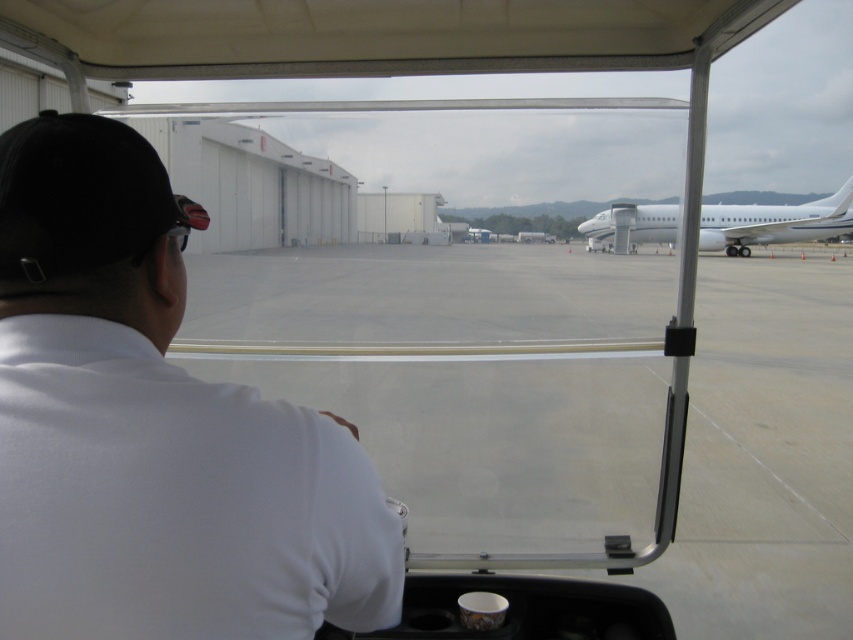
You are an airport security inspector checking the vehicle for any irregularities. You notice the white matte shirt at left and the white glossy airplane at right. Which object is wider in the image?

The white glossy airplane at right is wider than the white matte shirt at left.

You are a passenger in the vehicle and want to know which object is closer to you based on their sizes. Which one is closer between the white matte shirt at left and the white glossy airplane at right?

The white matte shirt at left is closer to you because it appears smaller than the white glossy airplane at right. In perspective, closer objects appear larger, but since the shirt is smaller, it might be farther. Wait, this seems contradictory. Let me think again. Wait, the description says the shirt is smaller than the airplane. If the shirt is smaller, according to perspective, smaller objects are farther away. So the airplane is closer? Hmm, the question is which is closer. The answer should be the one

What are the coordinates of the white matte shirt at left in the image?

The white matte shirt at left is located at coordinates point (x=154, y=428).